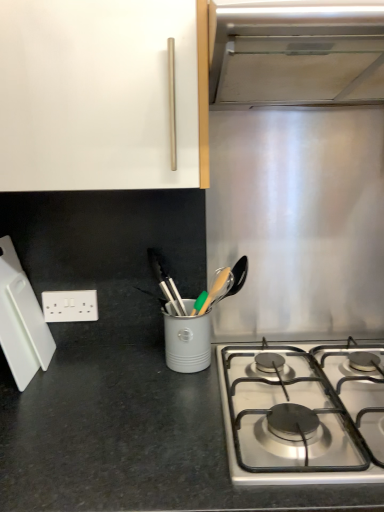
Question: From the image's perspective, is white plastic electric outlet at lower left over stainless steel gas stove at lower right?

Choices:
 (A) no
 (B) yes

Answer: (B)

Question: Is white plastic electric outlet at lower left further to the viewer compared to stainless steel gas stove at lower right?

Choices:
 (A) no
 (B) yes

Answer: (B)

Question: Considering the relative sizes of white plastic electric outlet at lower left and stainless steel gas stove at lower right in the image provided, is white plastic electric outlet at lower left thinner than stainless steel gas stove at lower right?

Choices:
 (A) yes
 (B) no

Answer: (A)

Question: Considering the relative sizes of white plastic electric outlet at lower left and stainless steel gas stove at lower right in the image provided, is white plastic electric outlet at lower left taller than stainless steel gas stove at lower right?

Choices:
 (A) yes
 (B) no

Answer: (A)

Question: Is white plastic electric outlet at lower left smaller than stainless steel gas stove at lower right?

Choices:
 (A) yes
 (B) no

Answer: (A)

Question: Is white plastic electric outlet at lower left closer to the viewer compared to stainless steel gas stove at lower right?

Choices:
 (A) no
 (B) yes

Answer: (A)

Question: Is stainless steel vent at upper right smaller than white glossy cabinet handle at upper center?

Choices:
 (A) no
 (B) yes

Answer: (B)

Question: Are stainless steel vent at upper right and white glossy cabinet handle at upper center far apart?

Choices:
 (A) no
 (B) yes

Answer: (A)

Question: Is stainless steel vent at upper right outside of white glossy cabinet handle at upper center?

Choices:
 (A) yes
 (B) no

Answer: (B)

Question: Is stainless steel vent at upper right touching white glossy cabinet handle at upper center?

Choices:
 (A) no
 (B) yes

Answer: (A)

Question: From the image's perspective, is stainless steel vent at upper right located beneath white glossy cabinet handle at upper center?

Choices:
 (A) no
 (B) yes

Answer: (A)

Question: Considering the relative positions of stainless steel vent at upper right and white glossy cabinet handle at upper center in the image provided, is stainless steel vent at upper right in front of white glossy cabinet handle at upper center?

Choices:
 (A) yes
 (B) no

Answer: (A)

Question: Is white glossy cabinet handle at upper center turned away from stainless steel gas stove at lower right?

Choices:
 (A) yes
 (B) no

Answer: (B)